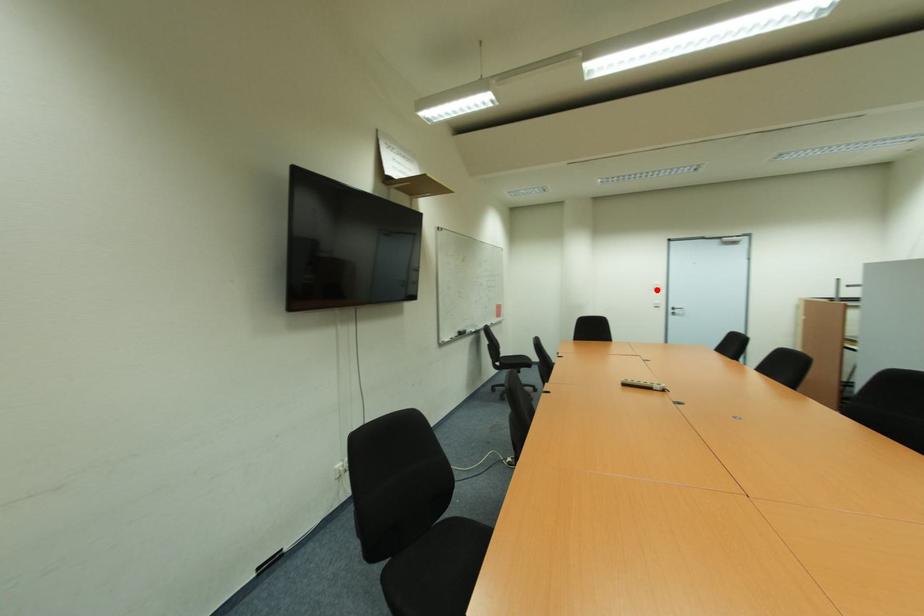
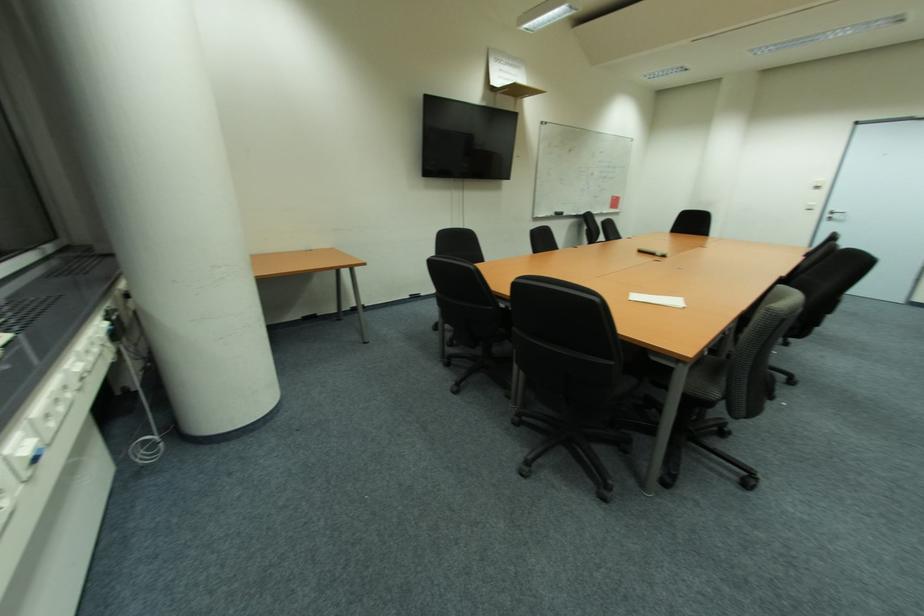
The point at the highlighted location is marked in the first image. Where is the corresponding point in the second image?

(820, 188)